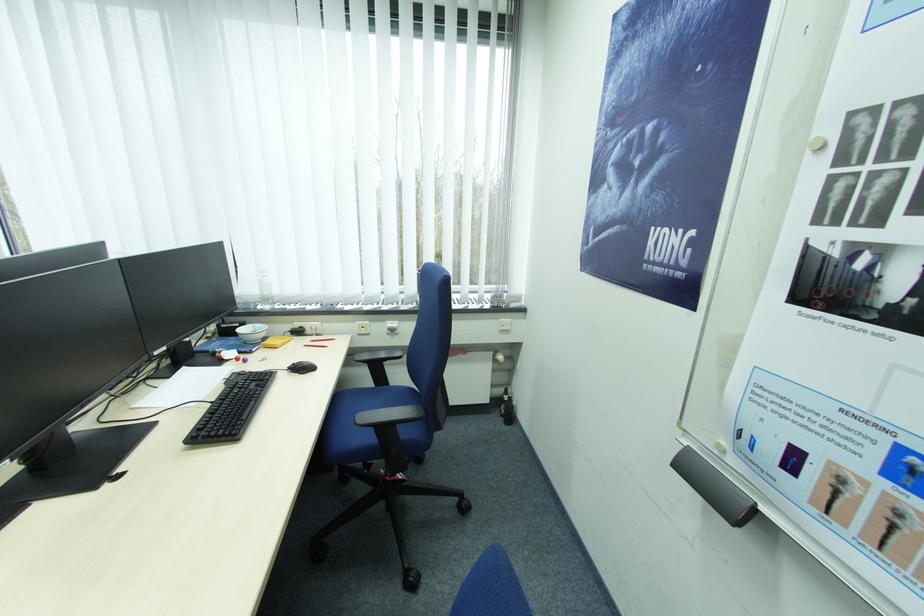
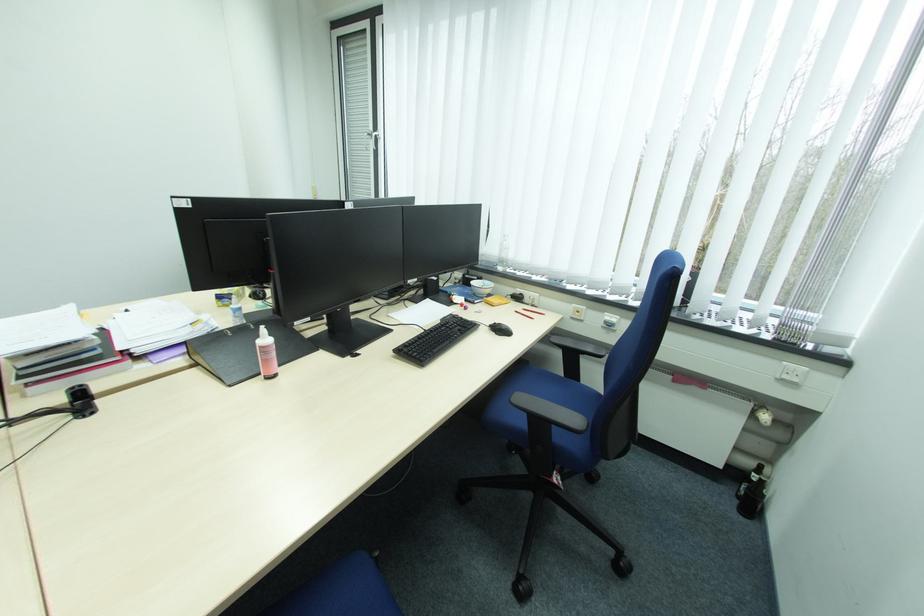
Question: The camera is either moving clockwise (left) or counter-clockwise (right) around the object. The first image is from the beginning of the video and the second image is from the end. Is the camera moving left or right when shooting the video?

Choices:
 (A) Left
 (B) Right

Answer: (B)